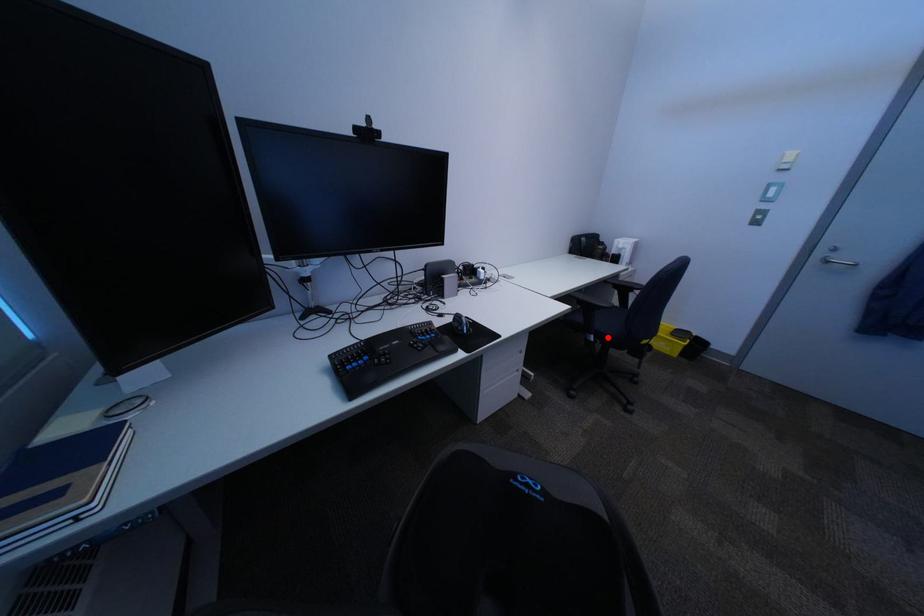
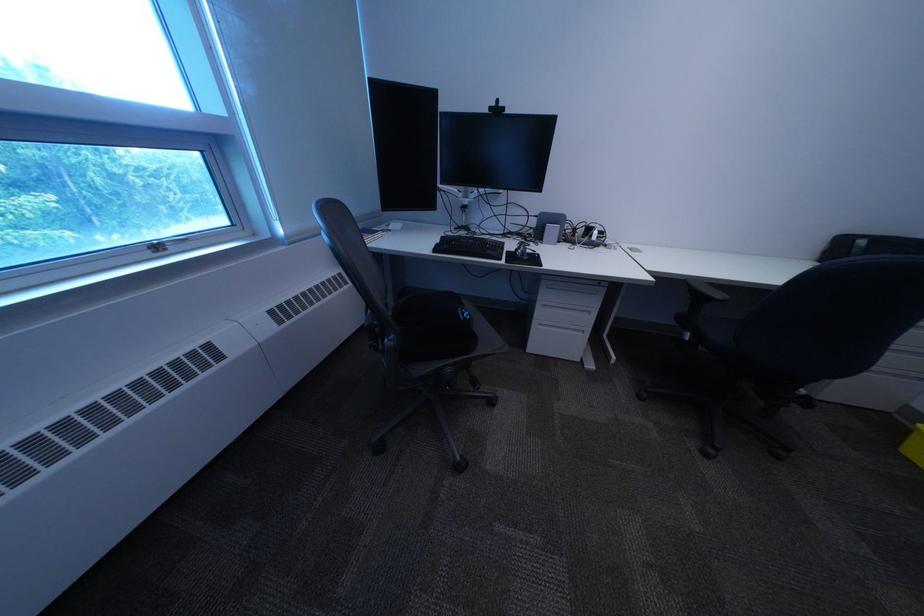
Question: I am providing you with two images of the same scene from different viewpoints. In image1, a red point is highlighted. Considering the same 3D point in image2, which of the following is correct?

Choices:
 (A) It is closer
 (B) It is farther

Answer: (A)